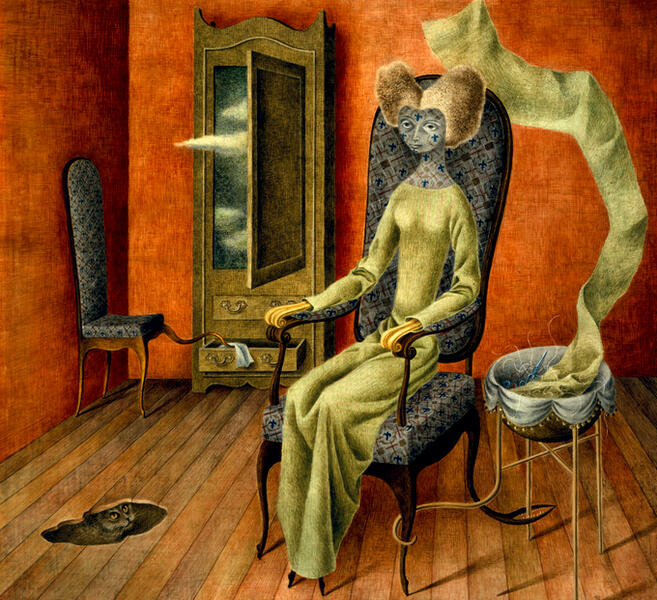
Locate an element on the screen. chair is located at coordinates (447, 405).